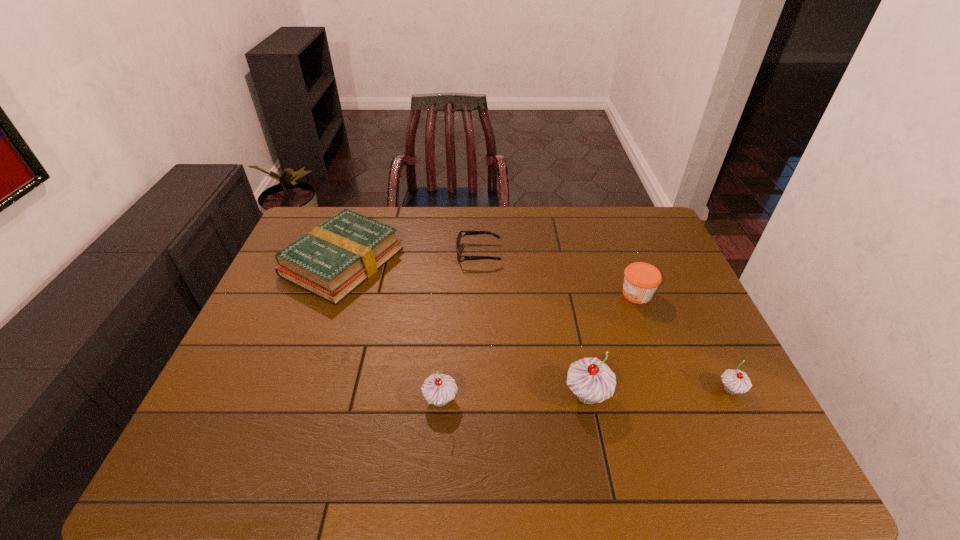
At what (x,y) coordinates should I click in order to perform the action: click on the leftmost cupcake. Please return your answer as a coordinate pair (x, y). Looking at the image, I should click on (438, 389).

Find the location of a particular element. Image resolution: width=960 pixels, height=540 pixels. the second tallest cupcake is located at coordinates (438, 389).

Identify the location of the second cupcake from right to left. (591, 380).

Where is `the tallest object`? The height and width of the screenshot is (540, 960). the tallest object is located at coordinates (591, 380).

Where is `the rightmost cupcake`? the rightmost cupcake is located at coordinates (735, 381).

The width and height of the screenshot is (960, 540). Find the location of `the shortest cupcake`. the shortest cupcake is located at coordinates (735, 381).

Locate an element on the screen. The image size is (960, 540). the shortest object is located at coordinates (458, 239).

At what (x,y) coordinates should I click in order to perform the action: click on the leftmost object. Please return your answer as a coordinate pair (x, y). Looking at the image, I should click on (332, 260).

Where is `the fifth object from left to right`? Image resolution: width=960 pixels, height=540 pixels. the fifth object from left to right is located at coordinates (641, 280).

What are the coordinates of `free location located on the right of the leftmost cupcake` in the screenshot? It's located at (505, 400).